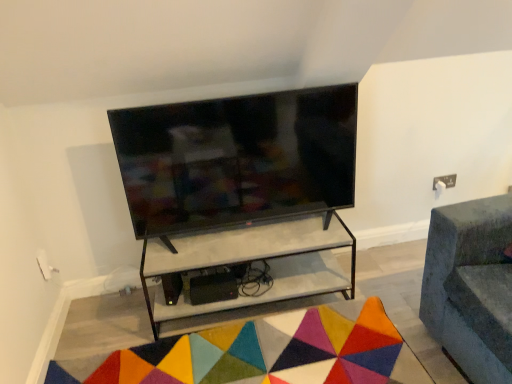
Where is `free point above white marble shelf at center (from a real-world perspective)`? The width and height of the screenshot is (512, 384). free point above white marble shelf at center (from a real-world perspective) is located at coordinates (240, 228).